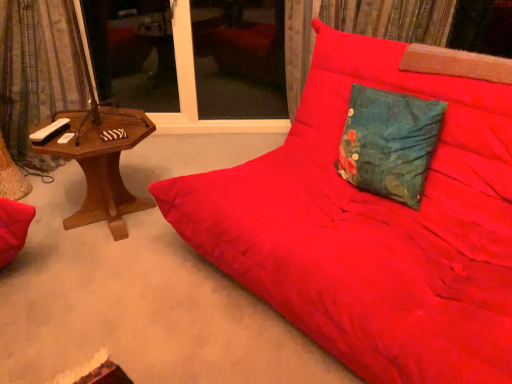
The image size is (512, 384). Describe the element at coordinates (37, 74) in the screenshot. I see `velvet-like curtain at left` at that location.

The height and width of the screenshot is (384, 512). I want to click on transparent glass window at center, which is the 1th window screen in right-to-left order, so click(239, 58).

What is the approximate width of transparent glass window at center, which is the 1th window screen in right-to-left order?

5.28 inches.

The height and width of the screenshot is (384, 512). What do you see at coordinates (102, 164) in the screenshot?
I see `woodenmaterial/texturetable at left` at bounding box center [102, 164].

I want to click on teal floral fabric pillow at center, so click(x=389, y=143).

In order to face matte red fabric studio couch at center, should I rotate leftwards or rightwards?

Turn right approximately 13.645 degrees to face it.

Image resolution: width=512 pixels, height=384 pixels. I want to click on velvet-like curtain at left, so click(x=37, y=74).

Is transparent glass window at upper center, which appears as the second window screen when viewed from the right, next to woodenmaterial/texturetable at left and touching it?

No.

Is point (177, 73) closer or farther from the camera than point (87, 121)?

Point (177, 73) appears to be farther away from the viewer than point (87, 121).

Is the position of transparent glass window at upper center, the first window screen from the left, less distant than that of woodenmaterial/texturetable at left?

No.

From a real-world perspective, is transparent glass window at upper center, the first window screen from the left, located beneath woodenmaterial/texturetable at left?

No, from a real-world perspective, transparent glass window at upper center, the first window screen from the left, is not beneath woodenmaterial/texturetable at left.

Is point (350, 282) closer or farther from the camera than point (277, 131)?

Point (350, 282).

In the scene shown: Could you tell me if matte red fabric studio couch at center is turned towards transparent glass window at upper center, the first window screen from the left?

No, matte red fabric studio couch at center is not facing towards transparent glass window at upper center, the first window screen from the left.

Relative to transparent glass window at upper center, which appears as the second window screen when viewed from the right, is matte red fabric studio couch at center in front or behind?

Clearly, matte red fabric studio couch at center is in front of transparent glass window at upper center, which appears as the second window screen when viewed from the right.

The image size is (512, 384). What are the coordinates of `studio couch lying on the right of transparent glass window at upper center, the first window screen from the left` in the screenshot? It's located at (372, 227).

From a real-world perspective, is velvet-like curtain at left located beneath woodenmaterial/texturetable at left?

Actually, velvet-like curtain at left is physically above woodenmaterial/texturetable at left in the real world.

Based on the photo, is velvet-like curtain at left not close to woodenmaterial/texturetable at left?

No, there isn't a large distance between velvet-like curtain at left and woodenmaterial/texturetable at left.

Who is taller, velvet-like curtain at left or woodenmaterial/texturetable at left?

Standing taller between the two is velvet-like curtain at left.

Does velvet-like curtain at left have a smaller size compared to woodenmaterial/texturetable at left?

No, velvet-like curtain at left is not smaller than woodenmaterial/texturetable at left.

Considering the positions of objects woodenmaterial/texturetable at left and transparent glass window at upper center, which appears as the second window screen when viewed from the right, in the image provided, who is in front, woodenmaterial/texturetable at left or transparent glass window at upper center, which appears as the second window screen when viewed from the right,?

→ Positioned in front is woodenmaterial/texturetable at left.

Does point (116, 222) come in front of point (250, 122)?

Yes, it is in front of point (250, 122).

From a real-world perspective, is woodenmaterial/texturetable at left positioned over transparent glass window at upper center, the first window screen from the left, based on gravity?

No, from a real-world perspective, woodenmaterial/texturetable at left is not over transparent glass window at upper center, the first window screen from the left

Is woodenmaterial/texturetable at left next to transparent glass window at upper center, the first window screen from the left, and touching it?

No, woodenmaterial/texturetable at left is not making contact with transparent glass window at upper center, the first window screen from the left.

Which is in front, velvet-like curtain at left or teal floral fabric pillow at center?

teal floral fabric pillow at center is closer to the camera.

Is teal floral fabric pillow at center at the back of velvet-like curtain at left?

No, velvet-like curtain at left is not facing the opposite direction of teal floral fabric pillow at center.

Does point (17, 115) appear closer or farther from the camera than point (365, 144)?

Point (17, 115) appears to be farther away from the viewer than point (365, 144).

Find the location of a particular element. The height and width of the screenshot is (384, 512). curtain lying behind the teal floral fabric pillow at center is located at coordinates (37, 74).

Is matte red fabric studio couch at center surrounded by transparent glass window at upper center, the first window screen from the left?

No, transparent glass window at upper center, the first window screen from the left, does not contain matte red fabric studio couch at center.

Looking at this image, is transparent glass window at upper center, which appears as the second window screen when viewed from the right, facing away from matte red fabric studio couch at center?

transparent glass window at upper center, which appears as the second window screen when viewed from the right, does not have its back to matte red fabric studio couch at center.

Between transparent glass window at upper center, which appears as the second window screen when viewed from the right, and matte red fabric studio couch at center, which one has more height?

matte red fabric studio couch at center.

Consider the image. Between matte red fabric studio couch at center and woodenmaterial/texturetable at left, which one appears on the right side from the viewer's perspective?

matte red fabric studio couch at center is more to the right.

Is matte red fabric studio couch at center positioned beyond the bounds of woodenmaterial/texturetable at left?

Yes, matte red fabric studio couch at center is located beyond the bounds of woodenmaterial/texturetable at left.

From the image's perspective, relative to woodenmaterial/texturetable at left, is matte red fabric studio couch at center above or below?

matte red fabric studio couch at center is situated lower than woodenmaterial/texturetable at left in the image.

This screenshot has height=384, width=512. I want to click on the 1st window screen behind the woodenmaterial/texturetable at left, counting from the anchor's position, so click(195, 91).

Locate an element on the screen. studio couch in front of the transparent glass window at upper center, the first window screen from the left is located at coordinates (372, 227).

From the image, which object appears to be nearer to transparent glass window at center, which is the 1th window screen in right-to-left order, matte red fabric studio couch at center or teal floral fabric pillow at center?

Based on the image, matte red fabric studio couch at center appears to be nearer to transparent glass window at center, which is the 1th window screen in right-to-left order.

Looking at the image, which one is located further to teal floral fabric pillow at center, transparent glass window at upper center, which appears as the second window screen when viewed from the right, or velvet-like curtain at left?

velvet-like curtain at left lies further to teal floral fabric pillow at center than the other object.

Considering their positions, is woodenmaterial/texturetable at left positioned closer to transparent glass window at upper center, which appears as the second window screen when viewed from the right, than teal floral fabric pillow at center?

woodenmaterial/texturetable at left.

Based on their spatial positions, is velvet-like curtain at left or teal floral fabric pillow at center closer to transparent glass window at upper center, which appears as the second window screen when viewed from the right?

The object closer to transparent glass window at upper center, which appears as the second window screen when viewed from the right, is velvet-like curtain at left.

When comparing their distances from velvet-like curtain at left, does teal floral fabric pillow at center or woodenmaterial/texturetable at left seem further?

teal floral fabric pillow at center.

Considering their positions, is transparent glass window at center, which is counted as the 2th window screen, starting from the left, positioned further to velvet-like curtain at left than teal floral fabric pillow at center?

teal floral fabric pillow at center is further to velvet-like curtain at left.

Estimate the real-world distances between objects in this image. Which object is closer to transparent glass window at upper center, which appears as the second window screen when viewed from the right, teal floral fabric pillow at center or woodenmaterial/texturetable at left?

woodenmaterial/texturetable at left is closer to transparent glass window at upper center, which appears as the second window screen when viewed from the right.

From the image, which object appears to be farther from transparent glass window at center, which is counted as the 2th window screen, starting from the left, velvet-like curtain at left or transparent glass window at upper center, which appears as the second window screen when viewed from the right?

The object further to transparent glass window at center, which is counted as the 2th window screen, starting from the left, is velvet-like curtain at left.

At what (x,y) coordinates should I click in order to perform the action: click on curtain between matte red fabric studio couch at center and transparent glass window at upper center, the first window screen from the left, along the z-axis. Please return your answer as a coordinate pair (x, y). Looking at the image, I should click on (37, 74).

I want to click on studio couch situated between velvet-like curtain at left and teal floral fabric pillow at center from left to right, so click(x=372, y=227).

I want to click on table between velvet-like curtain at left and transparent glass window at center, which is counted as the 2th window screen, starting from the left, so tap(102, 164).

Identify the location of window screen between woodenmaterial/texturetable at left and transparent glass window at center, which is counted as the 2th window screen, starting from the left, in the front-back direction. The height and width of the screenshot is (384, 512). (195, 91).